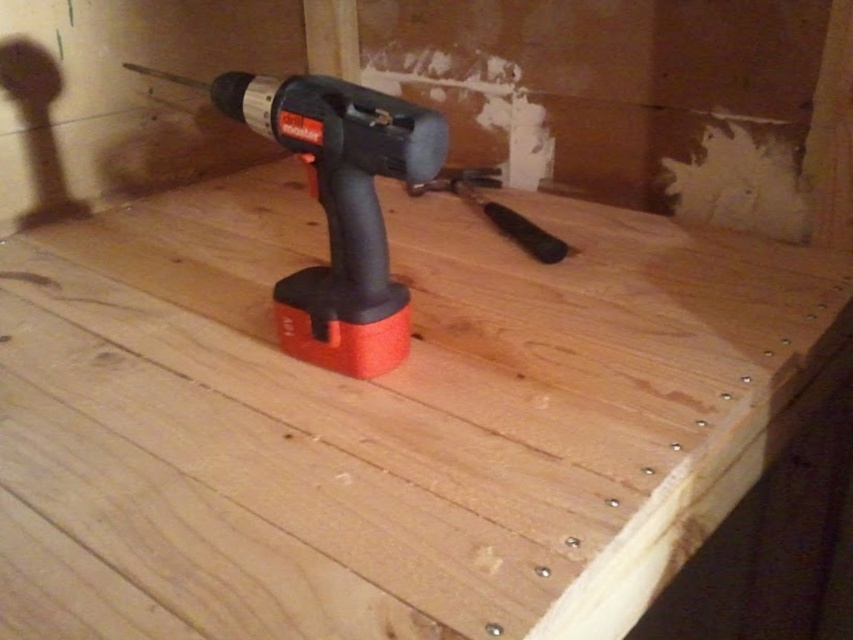
Does wooden table at center have a greater height compared to red plastic drill at center?

Correct, wooden table at center is much taller as red plastic drill at center.

Which is more to the left, wooden table at center or red plastic drill at center?

red plastic drill at center is more to the left.

Between point (123, 573) and point (305, 296), which one is positioned in front?

Positioned in front is point (123, 573).

You are a GUI agent. You are given a task and a screenshot of the screen. Output one action in this format:
    pyautogui.click(x=<x>, y=<y>)
    Task: Click on the wooden table at center
    The height and width of the screenshot is (640, 853).
    Given the screenshot: What is the action you would take?
    pyautogui.click(x=386, y=419)